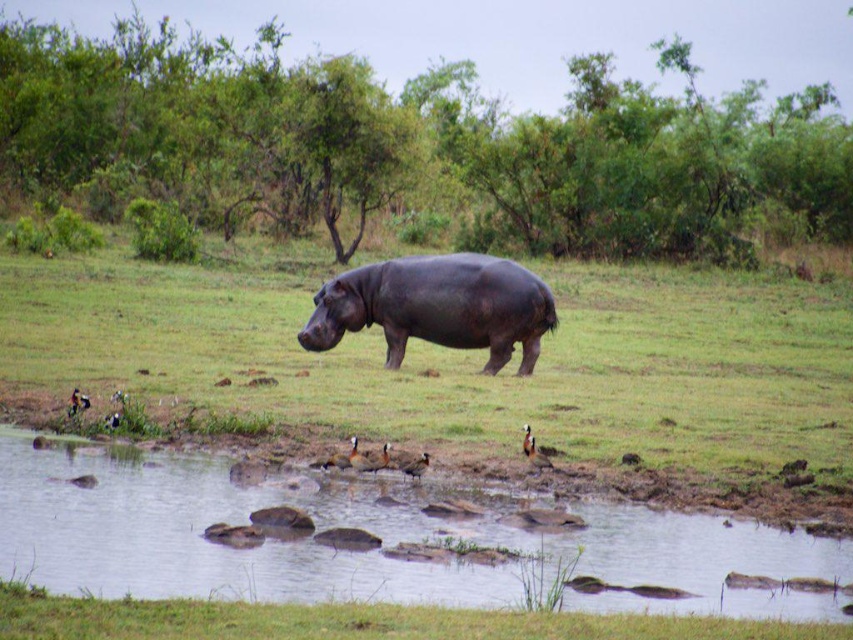
Is dark green grass at center positioned before dark brown matte hippo at center?

Yes, dark green grass at center is closer to the viewer.

Does point (699, 364) lie behind point (488, 332)?

That is True.

Which is behind, point (296, 413) or point (393, 360)?

Positioned behind is point (393, 360).

Identify the location of dark green grass at center. (463, 358).

Who is positioned more to the left, clear water at pond center or green grassy at lower center?

Positioned to the left is green grassy at lower center.

Does clear water at pond center appear over green grassy at lower center?

Actually, clear water at pond center is below green grassy at lower center.

Which is in front, point (335, 522) or point (289, 605)?

Point (289, 605)

Image resolution: width=853 pixels, height=640 pixels. Identify the location of clear water at pond center. click(370, 550).

Is clear water at pond center below dark brown matte hippo at center?

Yes, clear water at pond center is below dark brown matte hippo at center.

Does point (62, 544) lie behind point (364, 326)?

No.

Which is in front, point (331, 573) or point (509, 316)?

Point (331, 573) is more forward.

The width and height of the screenshot is (853, 640). What are the coordinates of `clear water at pond center` in the screenshot? It's located at (370, 550).